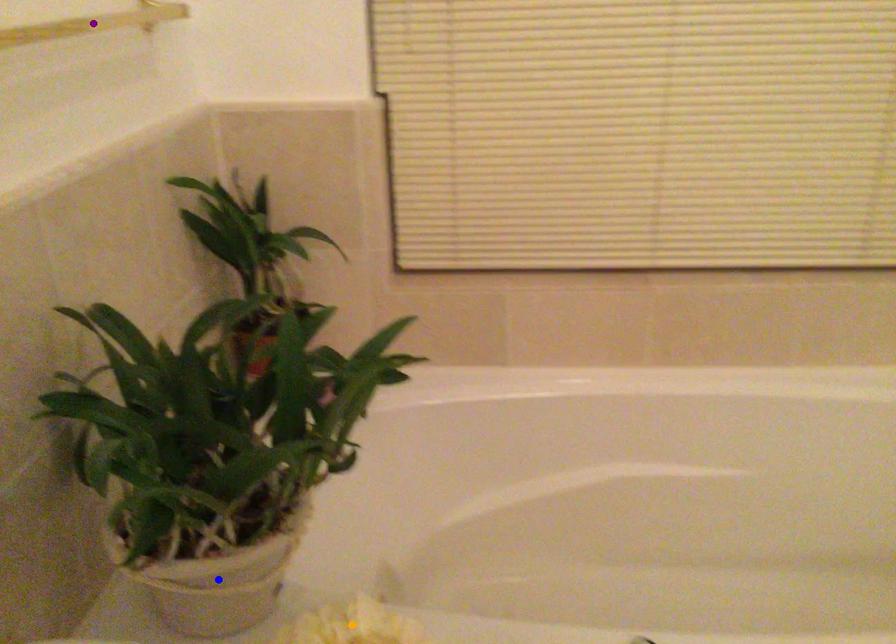
Order these from farthest to nearest:
A) orange point
B) blue point
C) purple point

purple point
orange point
blue point